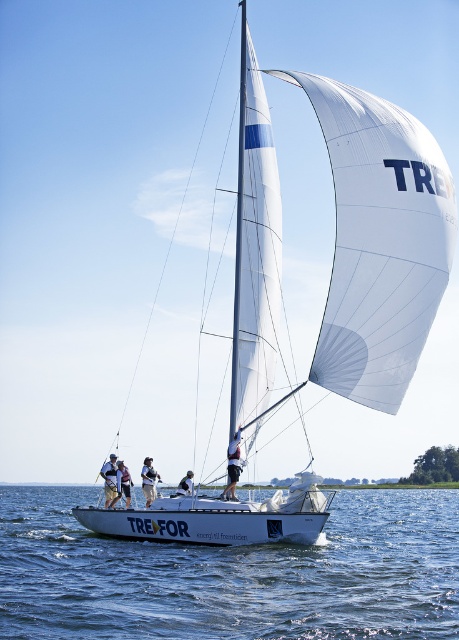
Who is positioned more to the right, white fabric shorts at center or white fabric life vest at center?

white fabric shorts at center

Where is `white fabric shorts at center`? The height and width of the screenshot is (640, 459). white fabric shorts at center is located at coordinates (233, 465).

Between white sail at center and white fabric life vest at center, which one appears on the right side from the viewer's perspective?

white sail at center is more to the right.

Can you confirm if white sail at center is thinner than white fabric life vest at center?

A: No, white sail at center is not thinner than white fabric life vest at center.

Is point (362, 349) farther from viewer compared to point (122, 483)?

That is False.

Where is `white sail at center`? white sail at center is located at coordinates (341, 244).

The width and height of the screenshot is (459, 640). What do you see at coordinates (233, 465) in the screenshot? I see `white fabric shorts at center` at bounding box center [233, 465].

Does point (234, 468) come in front of point (186, 484)?

Yes.

At what (x,y) coordinates should I click in order to perform the action: click on white fabric shorts at center. Please return your answer as a coordinate pair (x, y). This screenshot has width=459, height=640. Looking at the image, I should click on (233, 465).